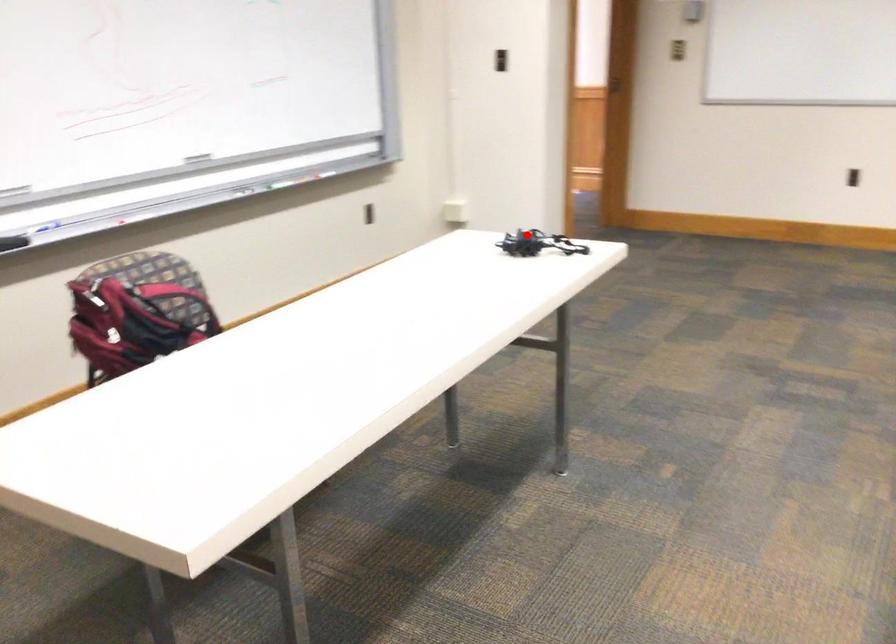
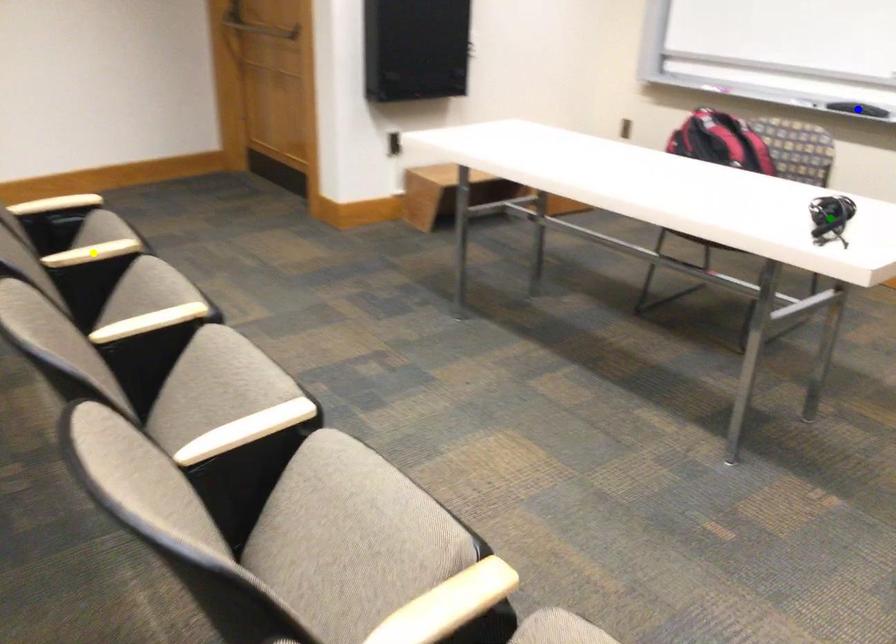
Question: I am providing you with two images of the same scene from different viewpoints. A red point is marked on the first image. You are given multiple points on the second image. Which point in image 2 is actually the same real-world point as the red point in image 1?

Choices:
 (A) yellow point
 (B) blue point
 (C) green point

Answer: (C)